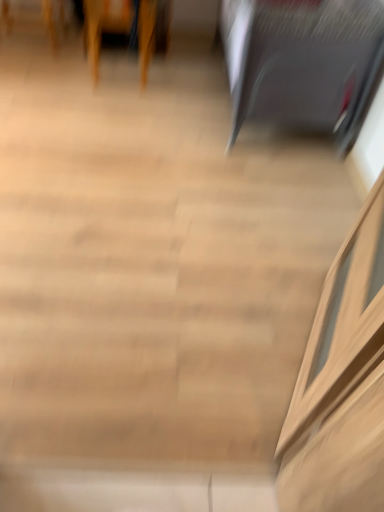
Identify the location of wooden chair at upper left, the second furniture viewed from the right. The image size is (384, 512). (104, 26).

This screenshot has width=384, height=512. What do you see at coordinates (104, 26) in the screenshot?
I see `wooden chair at upper left, the second furniture viewed from the right` at bounding box center [104, 26].

In order to face wooden chair at upper left, which is counted as the first furniture, starting from the left, should I rotate leftwards or rightwards?

To face it directly, rotate left by 9.735 degrees.

How much space does wooden chair at upper left, which is counted as the first furniture, starting from the left, occupy horizontally?

The width of wooden chair at upper left, which is counted as the first furniture, starting from the left, is 58.84 centimeters.

Measure the distance between point (154,0) and camera.

A distance of 2.53 meters exists between point (154,0) and camera.

What do you see at coordinates (302, 61) in the screenshot?
I see `satin black laptop at upper right, the 1th furniture viewed from the right` at bounding box center [302, 61].

Image resolution: width=384 pixels, height=512 pixels. I want to click on satin black laptop at upper right, the 2th furniture viewed from the left, so click(302, 61).

Image resolution: width=384 pixels, height=512 pixels. In order to click on wooden chair at upper left, the second furniture viewed from the right in this screenshot , I will do `click(104, 26)`.

Considering the relative positions of satin black laptop at upper right, the 1th furniture viewed from the right, and wooden chair at upper left, which is counted as the first furniture, starting from the left, in the image provided, is satin black laptop at upper right, the 1th furniture viewed from the right, to the right of wooden chair at upper left, which is counted as the first furniture, starting from the left, from the viewer's perspective?

Yes.

Which object is further away from the camera, satin black laptop at upper right, the 1th furniture viewed from the right, or wooden chair at upper left, the second furniture viewed from the right?

wooden chair at upper left, the second furniture viewed from the right.

Is point (346, 65) less distant than point (96, 7)?

Yes, point (346, 65) is in front of point (96, 7).

From the image's perspective, which object appears higher, satin black laptop at upper right, the 2th furniture viewed from the left, or wooden chair at upper left, the second furniture viewed from the right?

wooden chair at upper left, the second furniture viewed from the right, is shown above in the image.

From a real-world perspective, which is physically above, satin black laptop at upper right, the 1th furniture viewed from the right, or wooden chair at upper left, which is counted as the first furniture, starting from the left?

In real-world perspective, satin black laptop at upper right, the 1th furniture viewed from the right, is above.

Which of these two, satin black laptop at upper right, the 1th furniture viewed from the right, or wooden chair at upper left, the second furniture viewed from the right, is wider?

satin black laptop at upper right, the 1th furniture viewed from the right, is wider.

In the scene shown: Which of these two, satin black laptop at upper right, the 2th furniture viewed from the left, or wooden chair at upper left, which is counted as the first furniture, starting from the left, stands taller?

satin black laptop at upper right, the 2th furniture viewed from the left, is taller.

Considering the relative sizes of satin black laptop at upper right, the 2th furniture viewed from the left, and wooden chair at upper left, which is counted as the first furniture, starting from the left, in the image provided, is satin black laptop at upper right, the 2th furniture viewed from the left, smaller than wooden chair at upper left, which is counted as the first furniture, starting from the left,?

Incorrect, satin black laptop at upper right, the 2th furniture viewed from the left, is not smaller in size than wooden chair at upper left, which is counted as the first furniture, starting from the left.

From the picture: Does satin black laptop at upper right, the 2th furniture viewed from the left, contain wooden chair at upper left, the second furniture viewed from the right?

No, wooden chair at upper left, the second furniture viewed from the right, is not surrounded by satin black laptop at upper right, the 2th furniture viewed from the left.

Can you see satin black laptop at upper right, the 1th furniture viewed from the right, touching wooden chair at upper left, which is counted as the first furniture, starting from the left?

No, satin black laptop at upper right, the 1th furniture viewed from the right, is not with wooden chair at upper left, which is counted as the first furniture, starting from the left.

Is satin black laptop at upper right, the 1th furniture viewed from the right, turned away from wooden chair at upper left, the second furniture viewed from the right?

That's not correct — satin black laptop at upper right, the 1th furniture viewed from the right, is not looking away from wooden chair at upper left, the second furniture viewed from the right.

How many degrees apart are the facing directions of satin black laptop at upper right, the 1th furniture viewed from the right, and wooden chair at upper left, which is counted as the first furniture, starting from the left?

88.4 degrees.

Could you measure the distance between satin black laptop at upper right, the 2th furniture viewed from the left, and wooden chair at upper left, which is counted as the first furniture, starting from the left?

satin black laptop at upper right, the 2th furniture viewed from the left, is 38.71 inches away from wooden chair at upper left, which is counted as the first furniture, starting from the left.

In order to click on furniture below the satin black laptop at upper right, the 1th furniture viewed from the right (from a real-world perspective) in this screenshot , I will do `click(104, 26)`.

Which object is positioned more to the right, wooden chair at upper left, the second furniture viewed from the right, or satin black laptop at upper right, the 2th furniture viewed from the left?

Positioned to the right is satin black laptop at upper right, the 2th furniture viewed from the left.

Looking at this image, which object is further away from the camera, wooden chair at upper left, which is counted as the first furniture, starting from the left, or satin black laptop at upper right, the 2th furniture viewed from the left?

Positioned behind is wooden chair at upper left, which is counted as the first furniture, starting from the left.

Does point (95, 80) come behind point (267, 0)?

Yes, it is behind point (267, 0).

From the image's perspective, which one is positioned higher, wooden chair at upper left, the second furniture viewed from the right, or satin black laptop at upper right, the 1th furniture viewed from the right?

wooden chair at upper left, the second furniture viewed from the right.

From a real-world perspective, is wooden chair at upper left, which is counted as the first furniture, starting from the left, over satin black laptop at upper right, the 1th furniture viewed from the right?

No.

Can you confirm if wooden chair at upper left, which is counted as the first furniture, starting from the left, is wider than satin black laptop at upper right, the 1th furniture viewed from the right?

No, wooden chair at upper left, which is counted as the first furniture, starting from the left, is not wider than satin black laptop at upper right, the 1th furniture viewed from the right.

Who is shorter, wooden chair at upper left, the second furniture viewed from the right, or satin black laptop at upper right, the 2th furniture viewed from the left?

wooden chair at upper left, the second furniture viewed from the right.

In terms of size, does wooden chair at upper left, which is counted as the first furniture, starting from the left, appear bigger or smaller than satin black laptop at upper right, the 2th furniture viewed from the left?

Clearly, wooden chair at upper left, which is counted as the first furniture, starting from the left, is smaller in size than satin black laptop at upper right, the 2th furniture viewed from the left.

Consider the image. Is wooden chair at upper left, which is counted as the first furniture, starting from the left, not within satin black laptop at upper right, the 1th furniture viewed from the right?

Yes, wooden chair at upper left, which is counted as the first furniture, starting from the left, is outside of satin black laptop at upper right, the 1th furniture viewed from the right.

Is wooden chair at upper left, which is counted as the first furniture, starting from the left, oriented away from satin black laptop at upper right, the 1th furniture viewed from the right?

No, wooden chair at upper left, which is counted as the first furniture, starting from the left, is not facing away from satin black laptop at upper right, the 1th furniture viewed from the right.

Could you measure the distance between wooden chair at upper left, the second furniture viewed from the right, and satin black laptop at upper right, the 1th furniture viewed from the right?

wooden chair at upper left, the second furniture viewed from the right, and satin black laptop at upper right, the 1th furniture viewed from the right, are 98.31 centimeters apart from each other.

The width and height of the screenshot is (384, 512). Find the location of `furniture that appears below the wooden chair at upper left, the second furniture viewed from the right (from the image's perspective)`. furniture that appears below the wooden chair at upper left, the second furniture viewed from the right (from the image's perspective) is located at coordinates (302, 61).

Find the location of a particular element. The height and width of the screenshot is (512, 384). furniture above the wooden chair at upper left, the second furniture viewed from the right (from a real-world perspective) is located at coordinates (302, 61).

The height and width of the screenshot is (512, 384). In order to click on furniture on the left side of satin black laptop at upper right, the 1th furniture viewed from the right in this screenshot , I will do `click(104, 26)`.